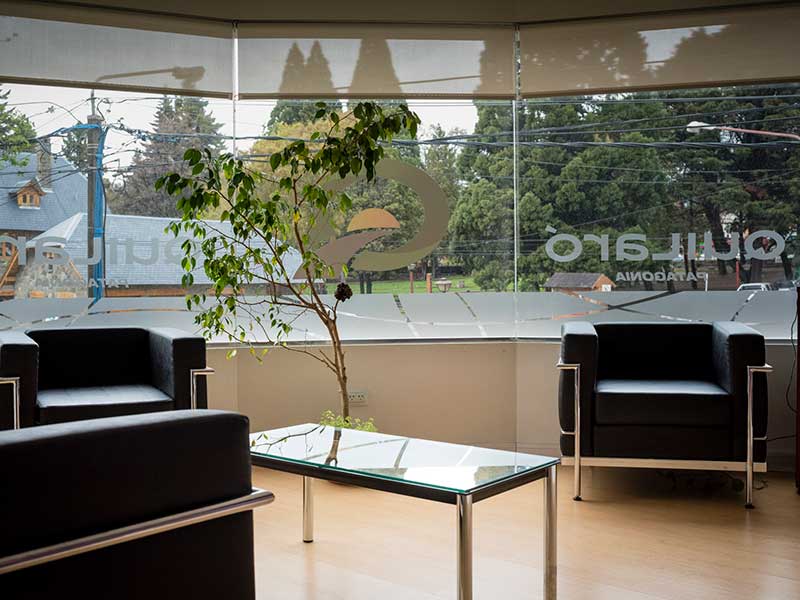
You are a GUI agent. You are given a task and a screenshot of the screen. Output one action in this format:
    pyautogui.click(x=<x>, y=<y>)
    Task: Click on the window
    The height and width of the screenshot is (600, 800).
    Given the screenshot: What is the action you would take?
    pyautogui.click(x=636, y=163), pyautogui.click(x=466, y=258), pyautogui.click(x=58, y=176)